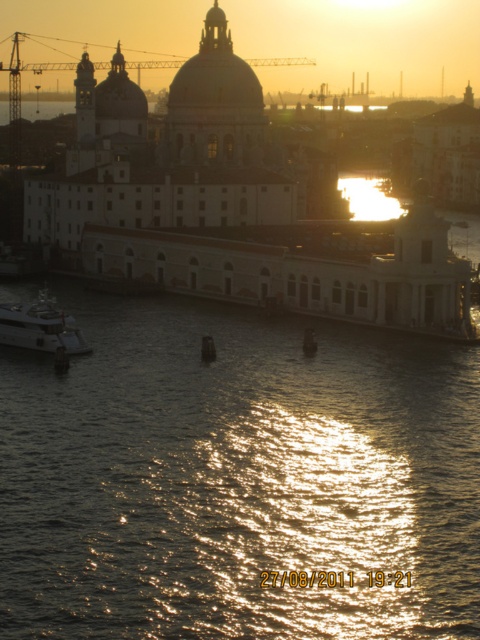
Can you confirm if shiny reflective water at lower center is thinner than shiny silver yacht at lower left?

No.

Does shiny reflective water at lower center have a greater width compared to shiny silver yacht at lower left?

Yes.

Who is more forward, (391, 509) or (28, 324)?

Positioned in front is point (391, 509).

The width and height of the screenshot is (480, 640). Identify the location of shiny reflective water at lower center. (236, 477).